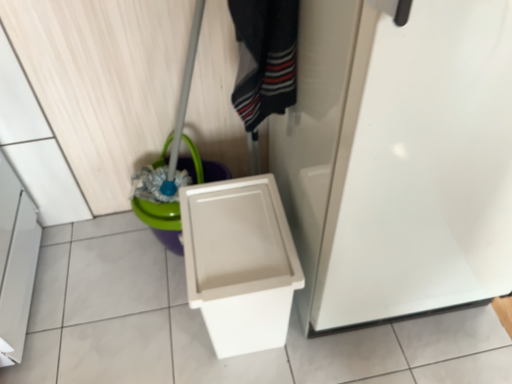
Question: In terms of width, does striped cotton socks at center look wider or thinner when compared to white plastic toilet at lower right?

Choices:
 (A) wide
 (B) thin

Answer: (B)

Question: From their relative heights in the image, would you say striped cotton socks at center is taller or shorter than white plastic toilet at lower right?

Choices:
 (A) tall
 (B) short

Answer: (B)

Question: Which object is the closest to the white glossy screen door at center?

Choices:
 (A) white plastic toilet at lower right
 (B) striped cotton socks at center
 (C) green plastic bucket at lower left

Answer: (A)

Question: Which of these objects is positioned farthest from the white glossy screen door at center?

Choices:
 (A) striped cotton socks at center
 (B) green plastic bucket at lower left
 (C) white plastic toilet at lower right

Answer: (B)